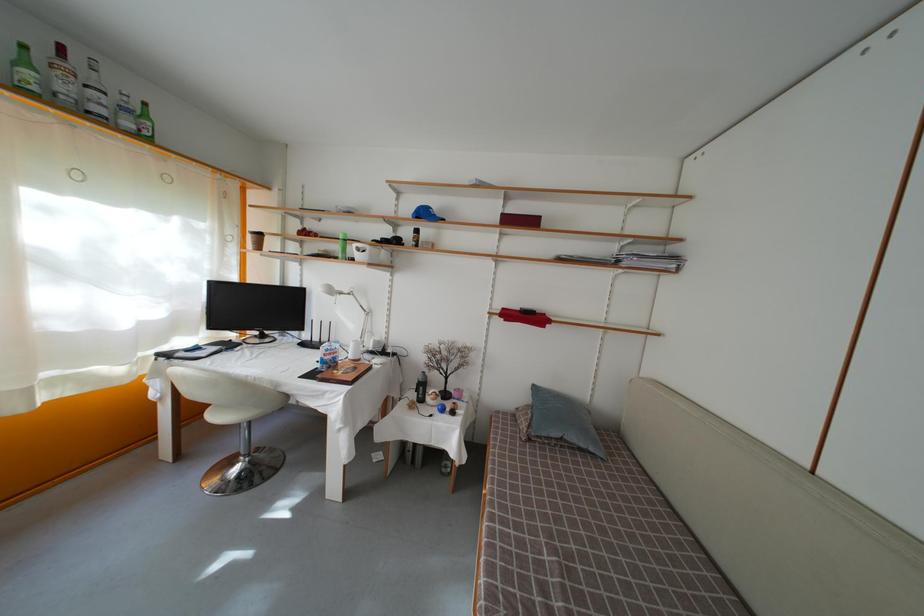
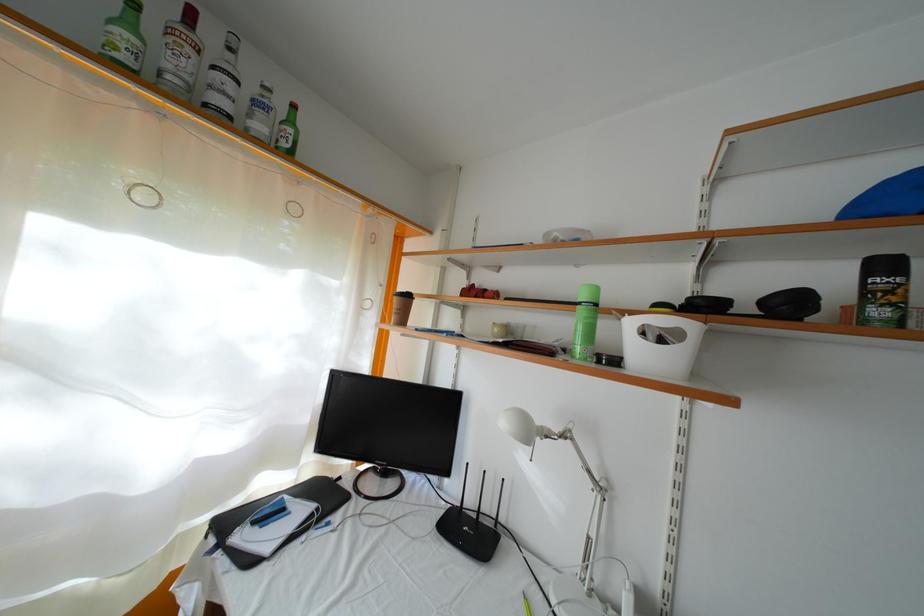
In the second image, find the point that corresponds to (370,257) in the first image.

(667, 346)